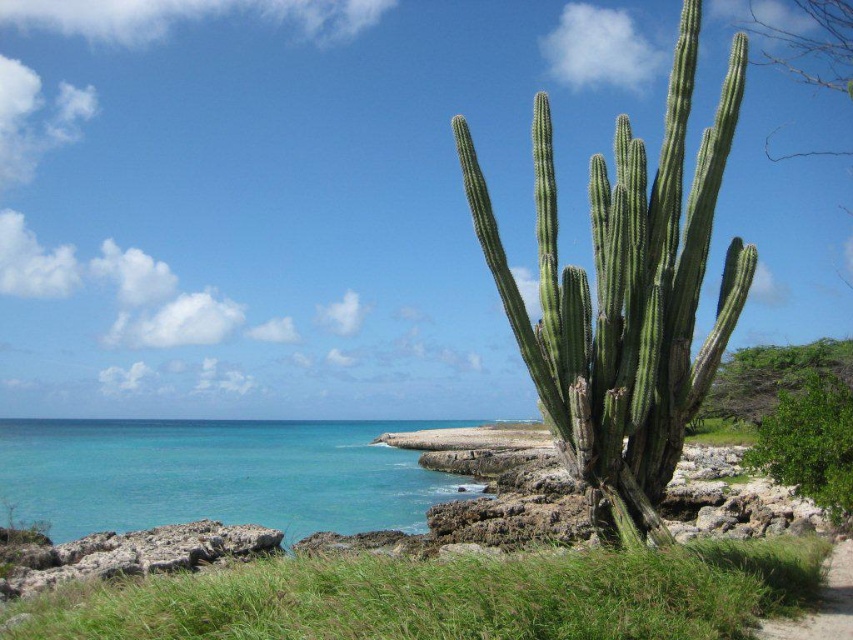
You are a hiker who wants to reach the turquoise water at lower left from the dirt path at lower right. Based on the scene, can you determine if you can walk directly to the water from the path without going around?

The turquoise water at lower left is positioned under dirt path at lower right, so the dirt path at lower right is above the turquoise water at lower left. Therefore, you can walk directly down from the dirt path at lower right to the turquoise water at lower left.

You are standing at the point marked as point (x=625, y=298) in the coastal landscape. What object are you currently standing on?

You are standing on the green succulent cactus at right.